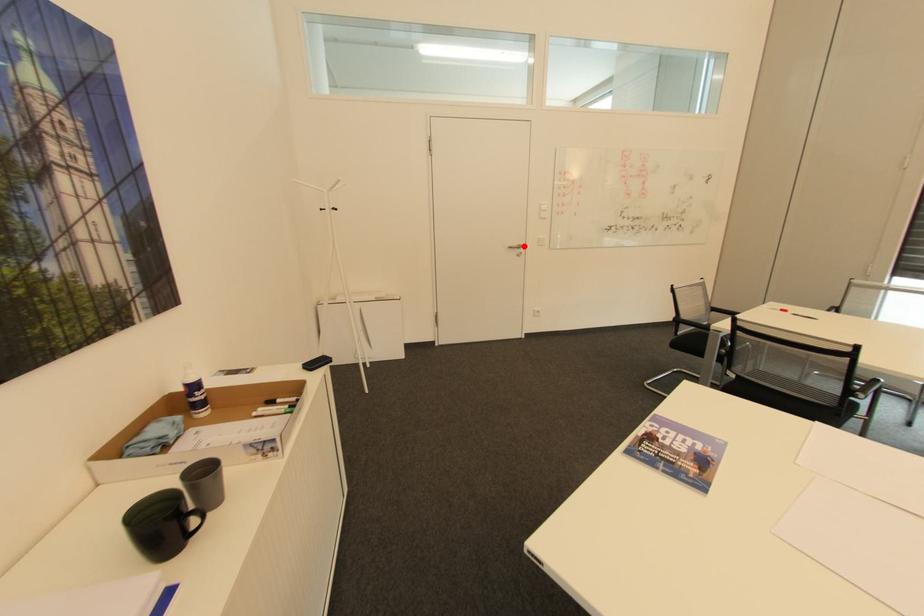
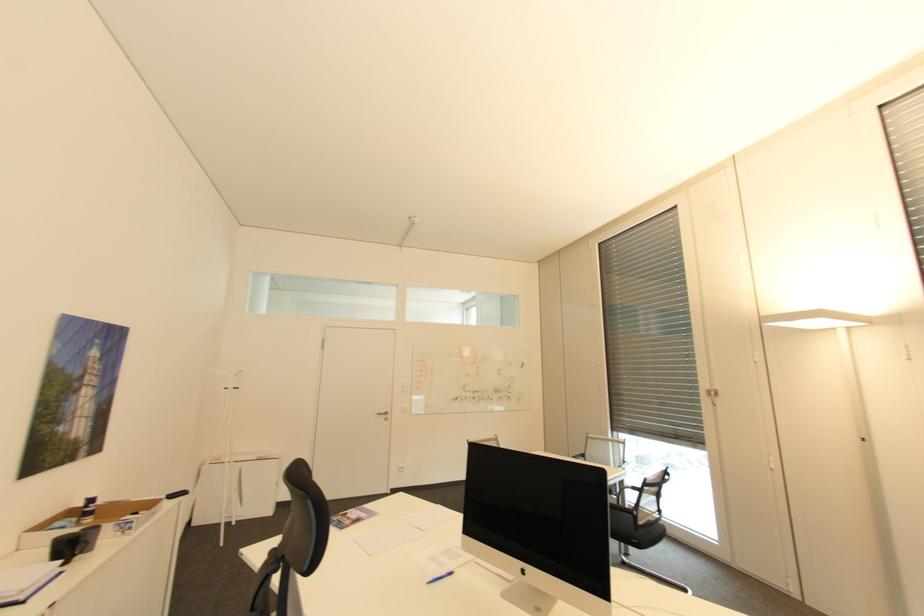
Question: I am providing you with two images of the same scene from different viewpoints. A red point is marked on the first image. At the location where the point appears in image 1, is it still visible in image 2?

Choices:
 (A) Yes
 (B) No

Answer: (A)